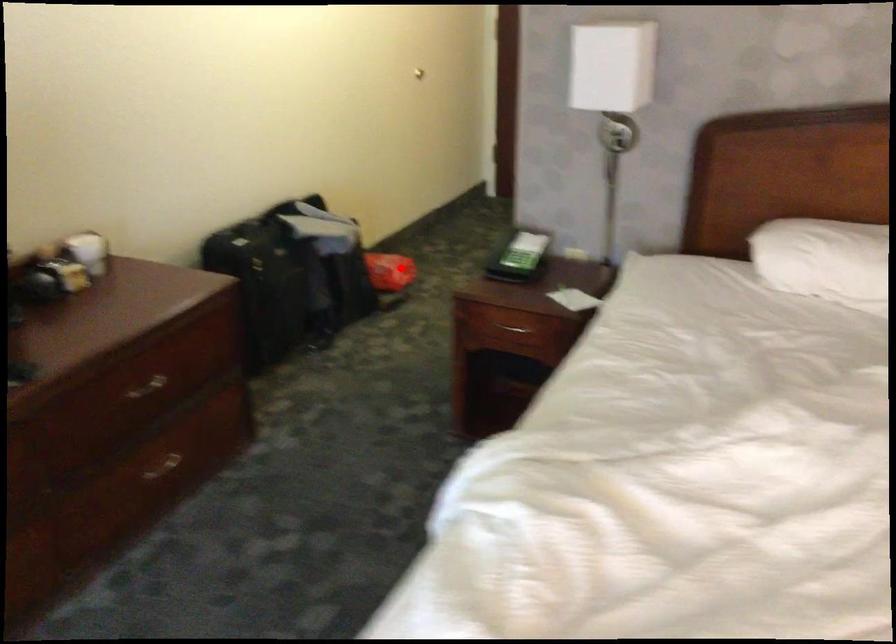
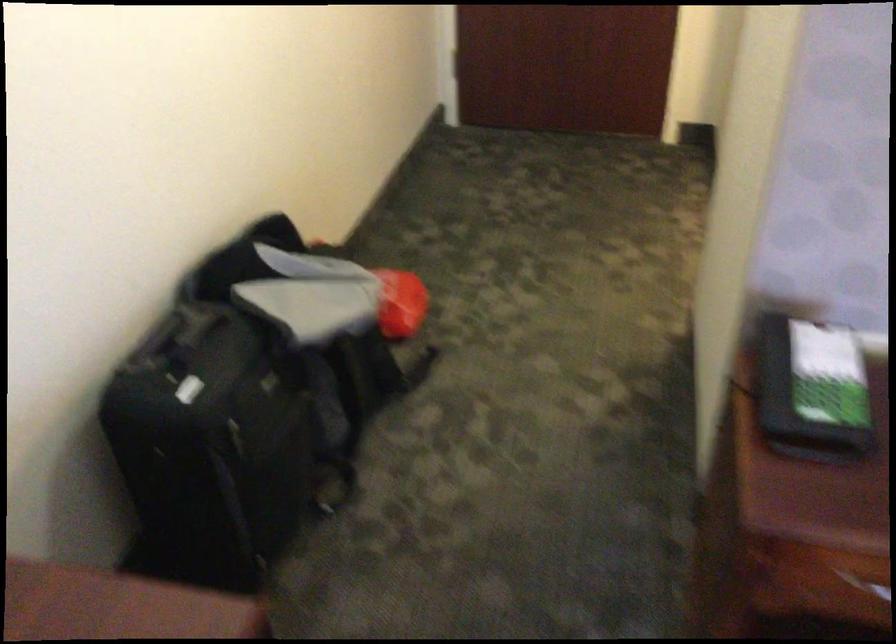
Question: I am providing you with two images of the same scene from different viewpoints. Image1 has a red point marked. In image2, the corresponding 3D location appears at what relative position? Reply with the corresponding letter.

Choices:
 (A) Closer
 (B) Farther

Answer: (A)